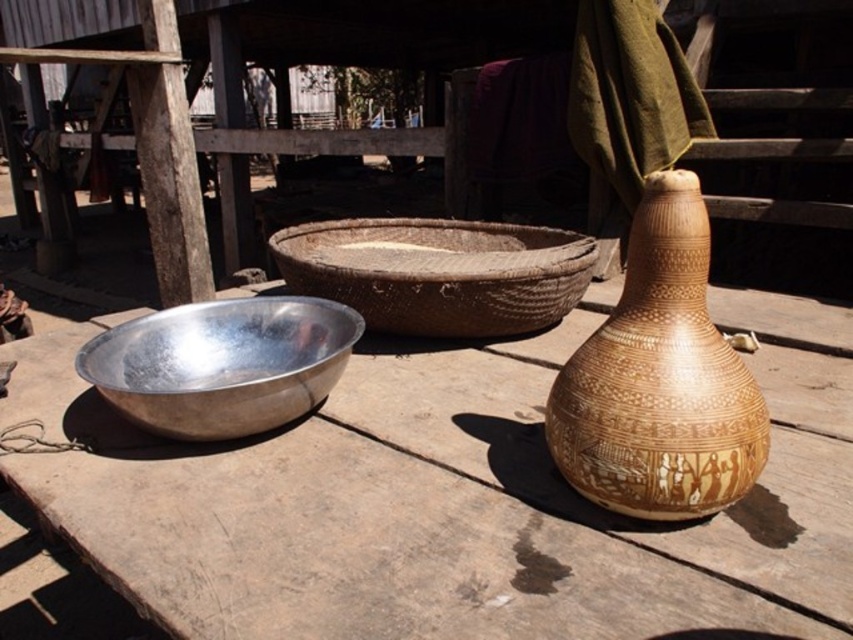
You are arranging flowers for a rustic outdoor event and have a brown textured vase at right and a silver metallic bowl at left. Which container should you choose if you want to place it on the lower shelf of your display stand that can only hold items placed below others?

The silver metallic bowl at left should be chosen because the brown textured vase at right is positioned over it, meaning the bowl is lower and fits the lower shelf requirement.

You are standing in front of the rustic outdoor setting and want to place a small potted plant on the surface. Which object, the metallic wood table at center or the silver metallic bowl at left, would be a more stable and level surface for the plant?

The metallic wood table at center is taller than the silver metallic bowl at left, so it would provide a more stable and level surface for the plant.

You are a delivery person who needs to place a package between the metallic bowl and the brown textured vase at right. The package is 18 inches long. Will it fit between them?

The distance between the metallic bowl and the brown textured vase at right is 38.03 inches. Since the package is 18 inches long, it will fit comfortably between them with space to spare.